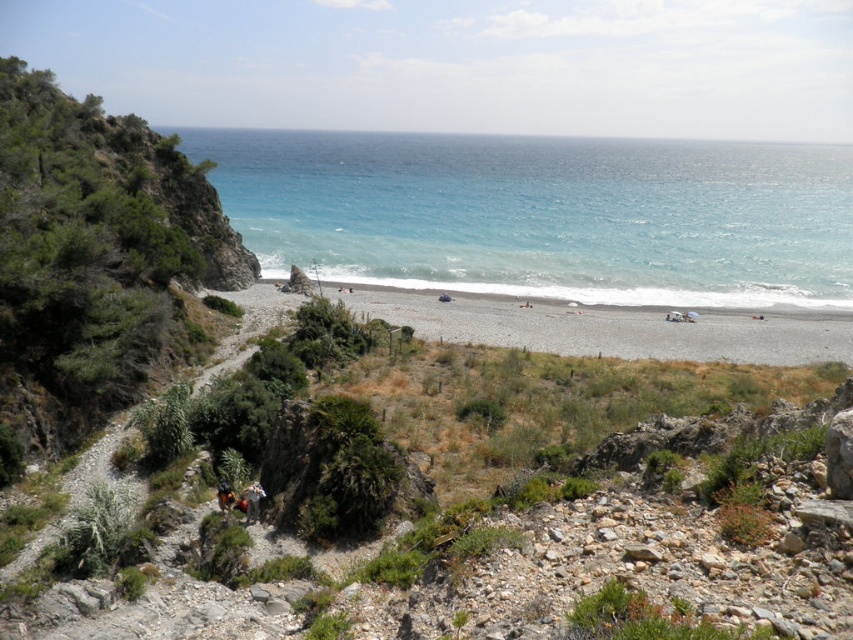
Is point (274, 216) more distant than point (70, 353)?

Yes.

Is blue water at center taller than green shrubbery at left?

Yes, blue water at center is taller than green shrubbery at left.

Is point (329, 205) closer to viewer compared to point (44, 401)?

No, it is behind (44, 401).

The image size is (853, 640). Identify the location of blue water at center. (544, 214).

Can you confirm if green shrubbery at left is positioned to the left of camouflage fabric person at lower center?

Correct, you'll find green shrubbery at left to the left of camouflage fabric person at lower center.

Measure the distance between point (132, 188) and camera.

Point (132, 188) is 74.02 meters away from camera.

Locate an element on the screen. green shrubbery at left is located at coordinates (94, 260).

Does blue water at center have a larger size compared to camouflage fabric person at lower center?

Correct, blue water at center is larger in size than camouflage fabric person at lower center.

Is blue water at center taller than camouflage fabric person at lower center?

Yes, blue water at center is taller than camouflage fabric person at lower center.

I want to click on blue water at center, so click(x=544, y=214).

Where is `blue water at center`? The image size is (853, 640). blue water at center is located at coordinates (544, 214).